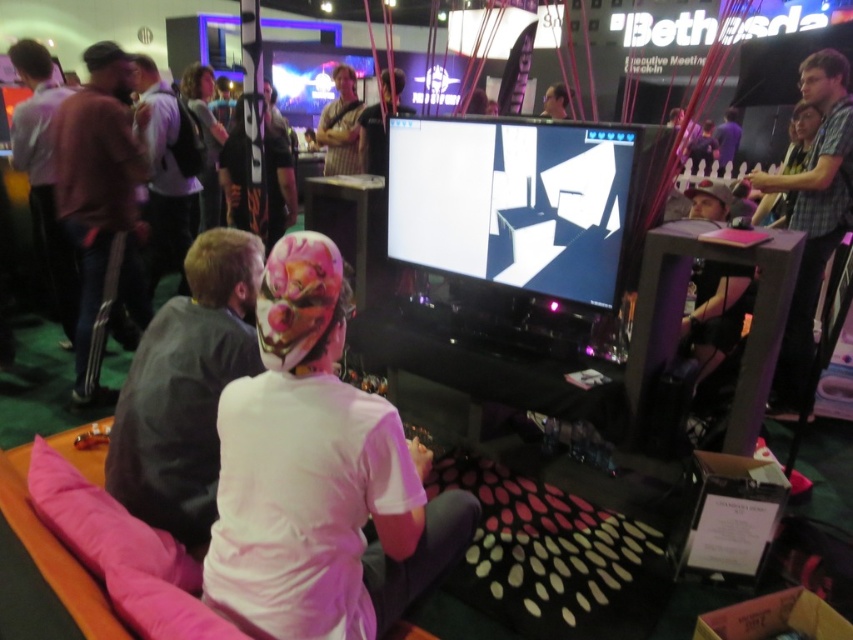
What are the coordinates of `black matte jacket at left` in the screenshot? It's located at (184, 388).

Which is above, black matte jacket at left or brown leather jacket at left?

Positioned higher is brown leather jacket at left.

Who is more forward, (252,346) or (70,188)?

Point (252,346) is more forward.

Find the location of a particular element. black matte jacket at left is located at coordinates (184, 388).

Is point (73, 186) behind point (805, 380)?

No, it is not.

Is brown leather jacket at left below plaid shirt at right?

No.

Which is in front, point (108, 51) or point (811, 195)?

Point (811, 195) is more forward.

I want to click on brown leather jacket at left, so click(102, 205).

Can you confirm if brown leather jacket at left is shorter than light brown leather jacket at left?

In fact, brown leather jacket at left may be taller than light brown leather jacket at left.

This screenshot has height=640, width=853. What do you see at coordinates (102, 205) in the screenshot?
I see `brown leather jacket at left` at bounding box center [102, 205].

Where is `brown leather jacket at left`? The width and height of the screenshot is (853, 640). brown leather jacket at left is located at coordinates (102, 205).